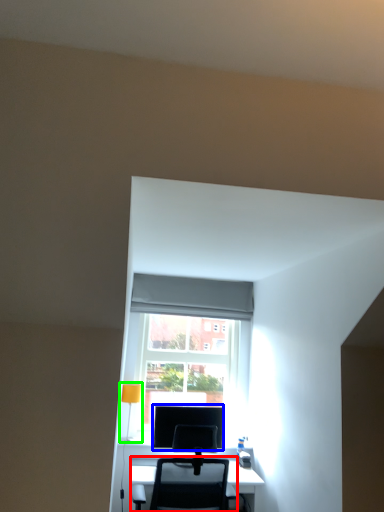
Question: Considering the real-world distances, which object is closest to chair (highlighted by a red box)? computer monitor (highlighted by a blue box) or table lamp (highlighted by a green box).

Choices:
 (A) computer monitor
 (B) table lamp

Answer: (A)